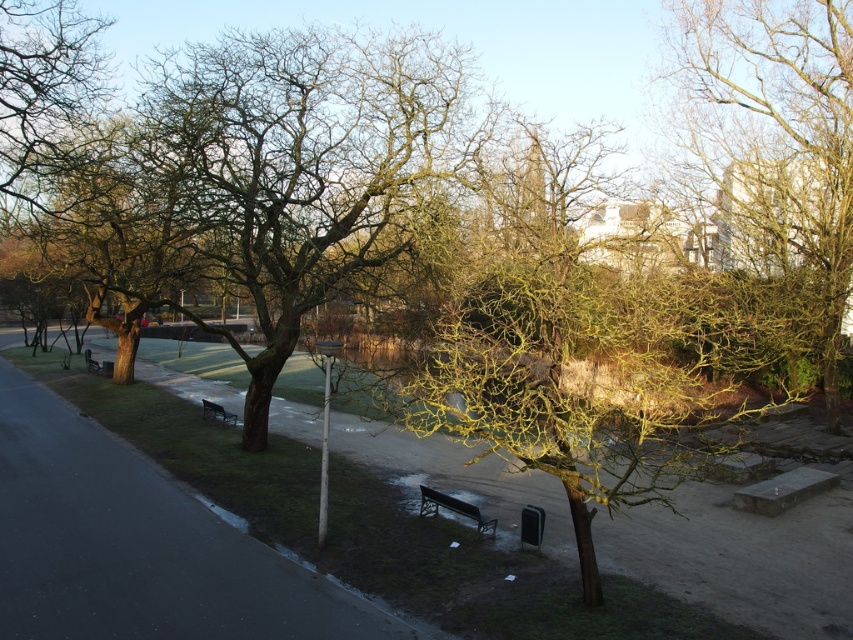
Measure the distance between green mossy tree at upper right and camera.

The distance of green mossy tree at upper right from camera is 51.38 feet.

Is green mossy tree at upper right to the right of wooden park bench at left from the viewer's perspective?

Indeed, green mossy tree at upper right is positioned on the right side of wooden park bench at left.

Which is behind, point (843, 129) or point (86, 355)?

Positioned behind is point (86, 355).

I want to click on green mossy tree at upper right, so click(x=779, y=145).

Is the position of green mossy tree at center more distant than that of metallic silver bench at center?

No, it is not.

Between green mossy tree at center and metallic silver bench at center, which one is positioned lower?

metallic silver bench at center is lower down.

Does point (769, 298) lie in front of point (477, 506)?

No, (769, 298) is behind (477, 506).

Where is `green mossy tree at center`? The height and width of the screenshot is (640, 853). green mossy tree at center is located at coordinates (579, 348).

You are a GUI agent. You are given a task and a screenshot of the screen. Output one action in this format:
    pyautogui.click(x=<x>, y=<y>)
    Task: Click on the green mossy tree at center
    
    Given the screenshot: What is the action you would take?
    pyautogui.click(x=579, y=348)

Is green mossy tree at center smaller than black plastic bench at lower left?

Actually, green mossy tree at center might be larger than black plastic bench at lower left.

Which is in front, point (701, 449) or point (209, 403)?

Positioned in front is point (701, 449).

The width and height of the screenshot is (853, 640). I want to click on green mossy tree at center, so point(579,348).